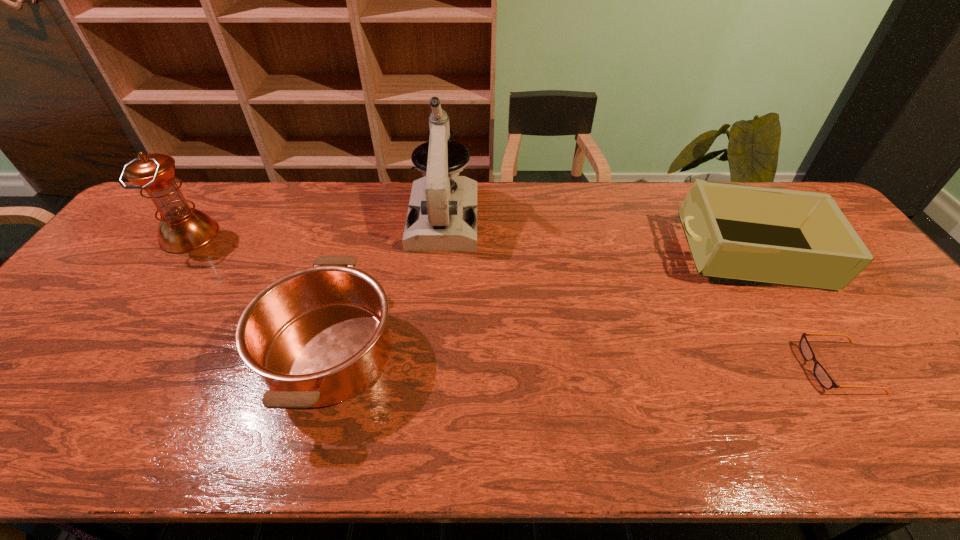
Identify the location of blank region between the microscope and the third tallest object. The height and width of the screenshot is (540, 960). (596, 237).

You are a GUI agent. You are given a task and a screenshot of the screen. Output one action in this format:
    pyautogui.click(x=<x>, y=<y>)
    Task: Click on the free spot between the tallest object and the box
    
    Given the screenshot: What is the action you would take?
    pyautogui.click(x=596, y=237)

Locate an element on the screen. The height and width of the screenshot is (540, 960). free space that is in between the spectacles and the saucepan is located at coordinates (584, 360).

Select which object appears as the fourth closest to the microscope. Please provide its 2D coordinates. Your answer should be formatted as a tuple, i.e. [(x, y)], where the tuple contains the x and y coordinates of a point satisfying the conditions above.

[(820, 373)]

Locate which object is the fourth closest to the saucepan. Please provide its 2D coordinates. Your answer should be formatted as a tuple, i.e. [(x, y)], where the tuple contains the x and y coordinates of a point satisfying the conditions above.

[(820, 373)]

You are a GUI agent. You are given a task and a screenshot of the screen. Output one action in this format:
    pyautogui.click(x=<x>, y=<y>)
    Task: Click on the vacant region that satisfies the following two spatial constraints: 1. on the front side of the leftmost object; 2. on the right side of the second shortest object
    The height and width of the screenshot is (540, 960).
    Given the screenshot: What is the action you would take?
    pyautogui.click(x=108, y=352)